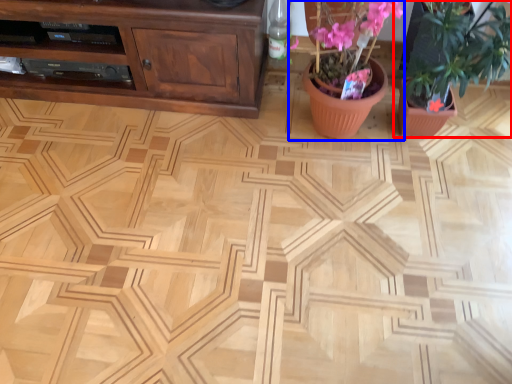
Question: Which object appears farthest to the camera in this image, houseplant (highlighted by a red box) or floral arrangement (highlighted by a blue box)?

Choices:
 (A) houseplant
 (B) floral arrangement

Answer: (B)